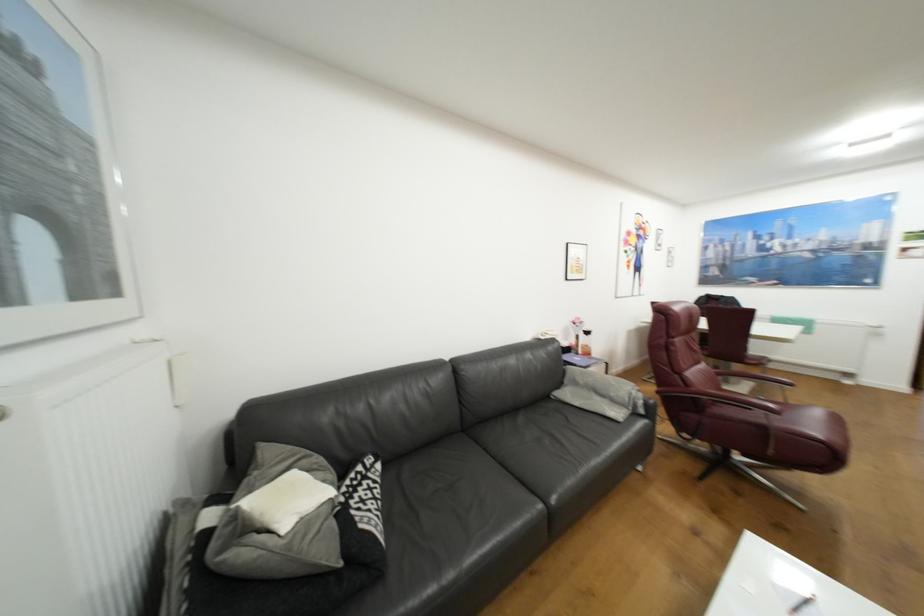
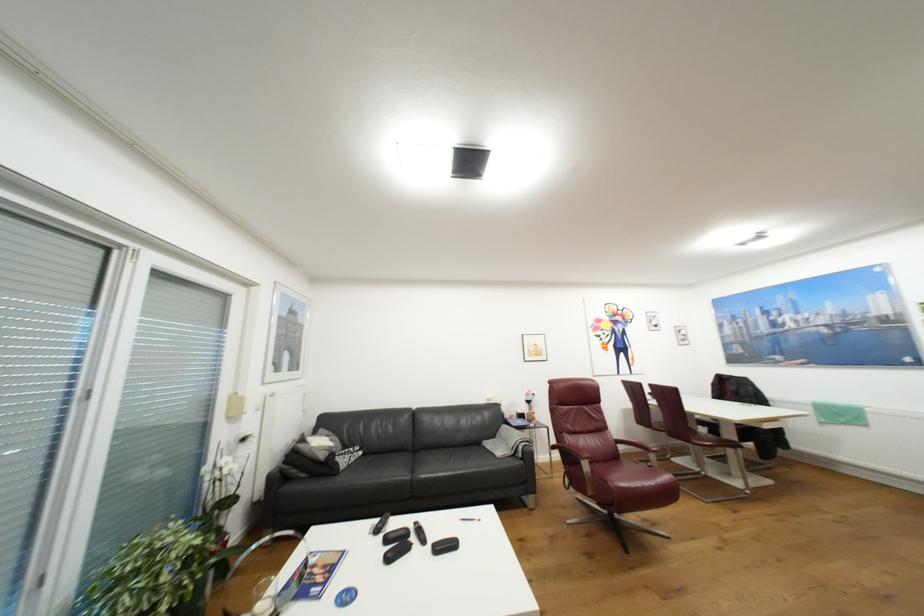
The point at (566, 384) is marked in the first image. Where is the corresponding point in the second image?

(500, 437)